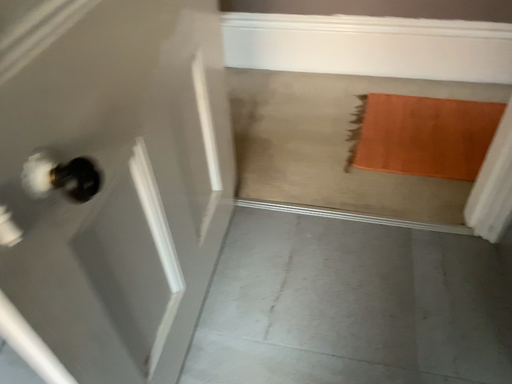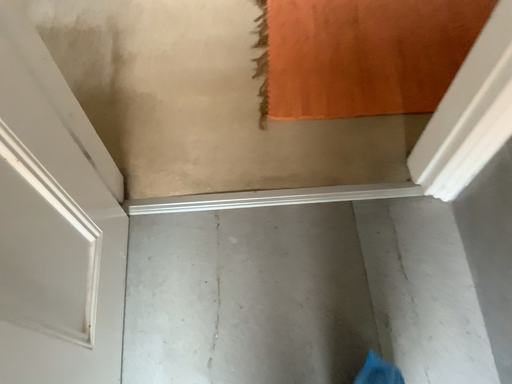
Question: Which way did the camera rotate in the video?

Choices:
 (A) rotated left
 (B) rotated right

Answer: (B)